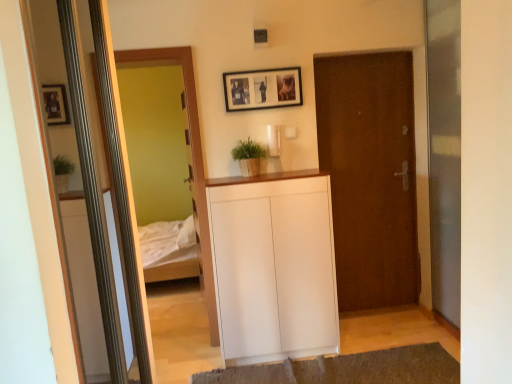
Question: Is wooden framed mirror at left thinner than white matte cabinet at center?

Choices:
 (A) yes
 (B) no

Answer: (A)

Question: Could you tell me if wooden framed mirror at left is facing white matte cabinet at center?

Choices:
 (A) yes
 (B) no

Answer: (B)

Question: From the image's perspective, does wooden framed mirror at left appear higher than white matte cabinet at center?

Choices:
 (A) no
 (B) yes

Answer: (B)

Question: Are wooden framed mirror at left and white matte cabinet at center making contact?

Choices:
 (A) yes
 (B) no

Answer: (B)

Question: Is wooden framed mirror at left wider than white matte cabinet at center?

Choices:
 (A) yes
 (B) no

Answer: (B)

Question: Considering the positions of brown matte door at center and transparent glass screen door at right in the image, is brown matte door at center bigger or smaller than transparent glass screen door at right?

Choices:
 (A) small
 (B) big

Answer: (A)

Question: From the image's perspective, is brown matte door at center located above or below transparent glass screen door at right?

Choices:
 (A) below
 (B) above

Answer: (A)

Question: Is brown matte door at center inside or outside of transparent glass screen door at right?

Choices:
 (A) outside
 (B) inside

Answer: (A)

Question: In terms of width, does brown matte door at center look wider or thinner when compared to transparent glass screen door at right?

Choices:
 (A) wide
 (B) thin

Answer: (B)

Question: Does point (373, 157) appear closer or farther from the camera than point (243, 72)?

Choices:
 (A) farther
 (B) closer

Answer: (A)

Question: Is brown matte door at center situated inside wooden framed photo at upper center or outside?

Choices:
 (A) outside
 (B) inside

Answer: (A)

Question: In terms of size, does brown matte door at center appear bigger or smaller than wooden framed photo at upper center?

Choices:
 (A) big
 (B) small

Answer: (A)

Question: From a real-world perspective, is brown matte door at center positioned above or below wooden framed photo at upper center?

Choices:
 (A) below
 (B) above

Answer: (A)

Question: Choose the correct answer: Is white matte cabinet at center inside wooden framed mirror at left or outside it?

Choices:
 (A) inside
 (B) outside

Answer: (B)

Question: Considering their positions, is white matte cabinet at center located in front of or behind wooden framed mirror at left?

Choices:
 (A) front
 (B) behind

Answer: (A)